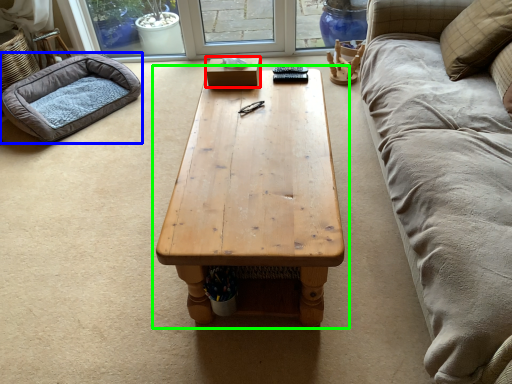
Question: Which is farther away from box (highlighted by a red box)? dog bed (highlighted by a blue box) or coffee table (highlighted by a green box)?

Choices:
 (A) dog bed
 (B) coffee table

Answer: (A)